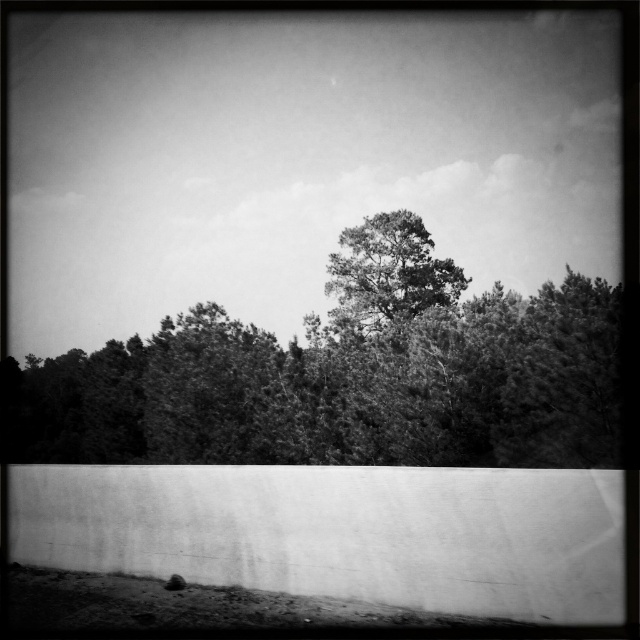
You are an arborist assessing a forest area. You observe two trees in the image, the dark green textured tree at center and the grainy black tree at center. Which tree would you need to climb higher to reach the top?

The dark green textured tree at center is much taller than the grainy black tree at center, so you would need to climb higher to reach the top of the dark green textured tree at center.

Looking at this image, you are standing at the bottom of the image looking towards the wall and the trees. There are two points marked in the scene. The first point is at coordinates point (300, 372) and the second is at point (417, 252). Which of these two points is closer to you?

Point (300, 372) is closer to you because it is in front of point (417, 252).